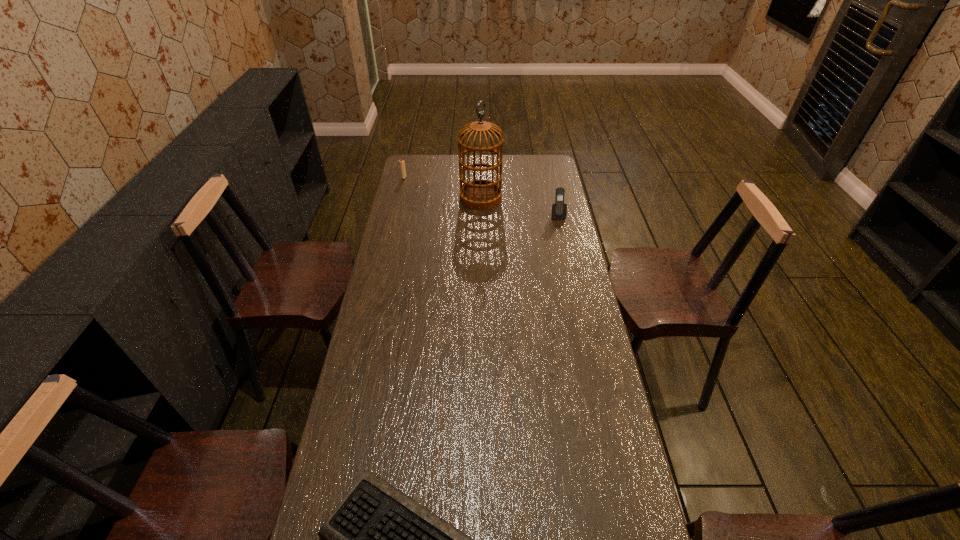
Locate an element on the screen. This screenshot has width=960, height=540. object that is at the left edge is located at coordinates (402, 163).

Find the location of `object that is at the right edge`. object that is at the right edge is located at coordinates (559, 210).

What are the coordinates of `object that is at the far left corner` in the screenshot? It's located at (402, 163).

Locate an element on the screen. blank space at the left edge is located at coordinates (410, 245).

Find the location of `vacant area at the right edge of the desktop`. vacant area at the right edge of the desktop is located at coordinates (555, 240).

Where is `free space between the third nearest object and the third tallest object`? free space between the third nearest object and the third tallest object is located at coordinates (443, 187).

Identify the location of object that is the third closest to the tallest object. The width and height of the screenshot is (960, 540). (378, 539).

This screenshot has height=540, width=960. What are the coordinates of `object that stands as the closest to the farthest object` in the screenshot? It's located at (480, 194).

Find the location of a particular element. This screenshot has height=540, width=960. free region that satisfies the following two spatial constraints: 1. on the front side of the second shortest object; 2. on the left side of the tallest object is located at coordinates (399, 198).